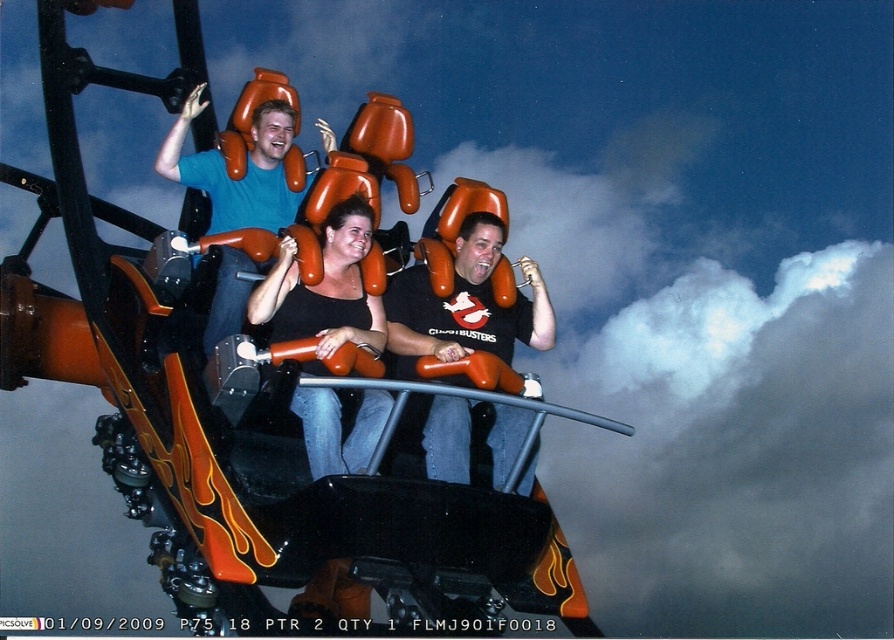
Question: Where is orange flame-painted roller coaster car at center located in relation to black matte ghostbusters t-shirt at center in the image?

Choices:
 (A) left
 (B) right

Answer: (A)

Question: Can you confirm if black matte ghostbusters t-shirt at center is smaller than matte orange seat at center?

Choices:
 (A) no
 (B) yes

Answer: (B)

Question: Which object appears closest to the camera in this image?

Choices:
 (A) matte orange seat at center
 (B) orange flame-painted roller coaster car at center

Answer: (B)

Question: Which of these objects is positioned closest to the matte orange seat at center?

Choices:
 (A) black matte ghostbusters t-shirt at center
 (B) orange flame-painted roller coaster car at center

Answer: (B)

Question: Can you confirm if orange flame-painted roller coaster car at center is thinner than black matte ghostbusters t-shirt at center?

Choices:
 (A) no
 (B) yes

Answer: (A)

Question: Which object is farther from the camera taking this photo?

Choices:
 (A) matte orange seat at center
 (B) black matte ghostbusters t-shirt at center

Answer: (A)